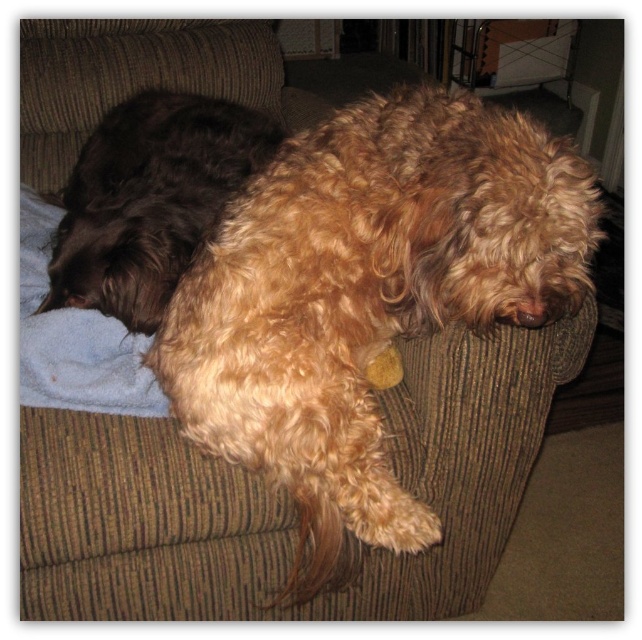
Can you confirm if fuzzy brown dog at center is positioned below shaggy brown dog at upper left?

Correct, fuzzy brown dog at center is located below shaggy brown dog at upper left.

Can you confirm if fuzzy brown dog at center is thinner than shaggy brown dog at upper left?

No, fuzzy brown dog at center is not thinner than shaggy brown dog at upper left.

The width and height of the screenshot is (642, 640). What are the coordinates of `fuzzy brown dog at center` in the screenshot? It's located at (367, 298).